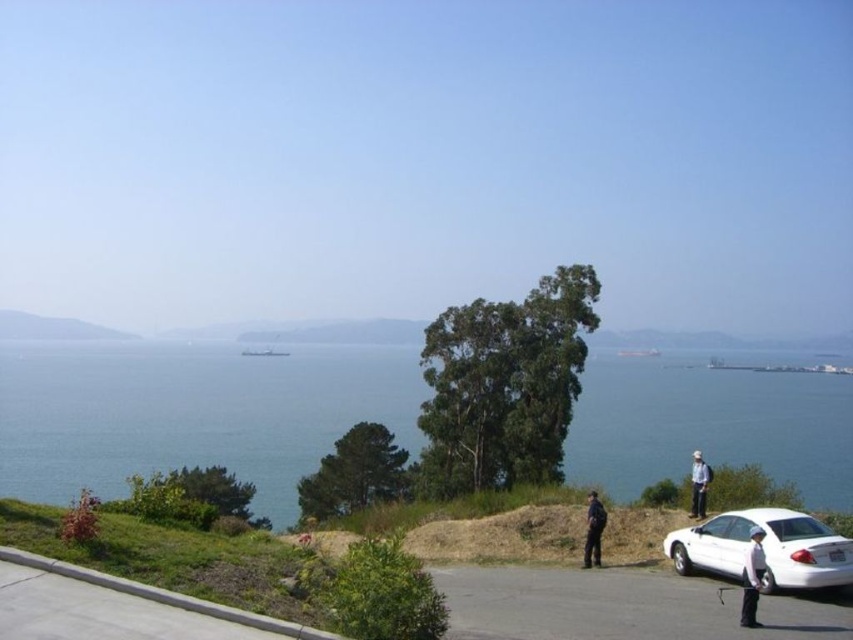
You are a security guard on duty at the coastal area. You see a person in a black uniform at center and another in a white fabric shirt at lower right. Which individual is closer to you?

The black uniform at center is closer to the viewer than the white fabric shirt at lower right, so the individual in the black uniform at center is closer to you.

You are a photographer planning to take a group photo of the two people in the scene. You want to position them so that the white fabric shirt at lower right is on the left side of the black uniform at center. Is this arrangement possible based on their current positions?

The black uniform at center is currently to the left of the white fabric shirt at lower right. To position the white fabric shirt at lower right on the left side of the black uniform at center, they would need to swap places, which is possible as there is space between them and the mound of earth.